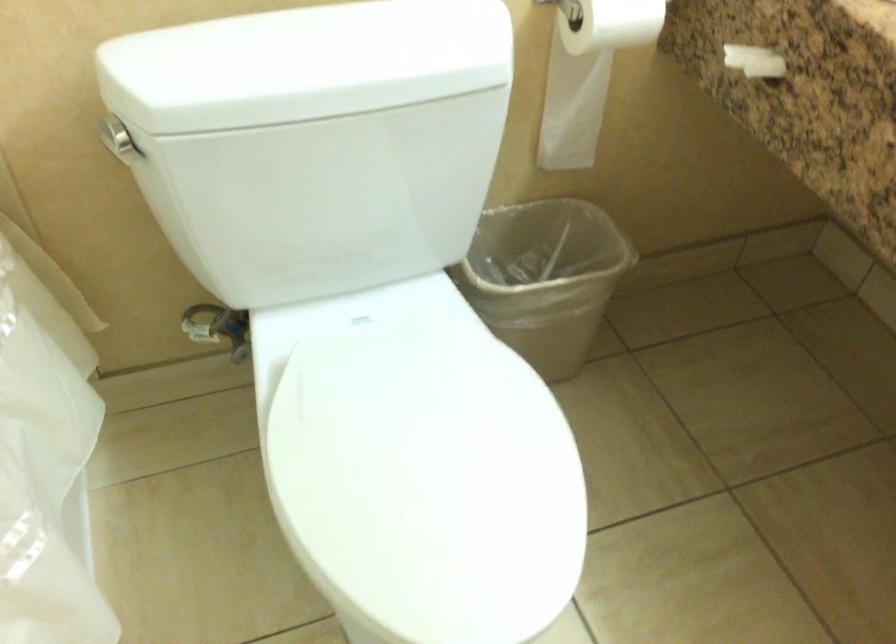
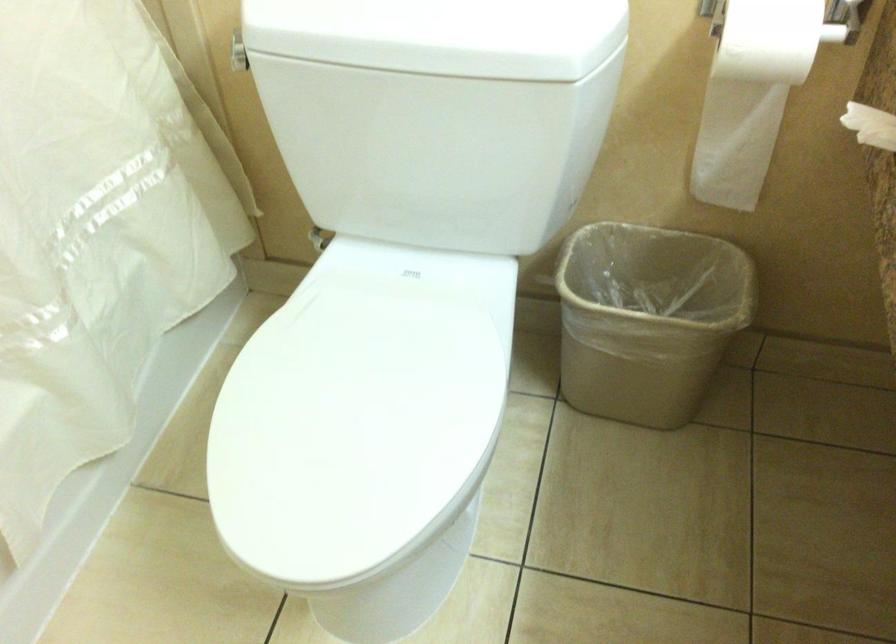
Where in the second image is the point corresponding to point 330,77 from the first image?

(393, 35)